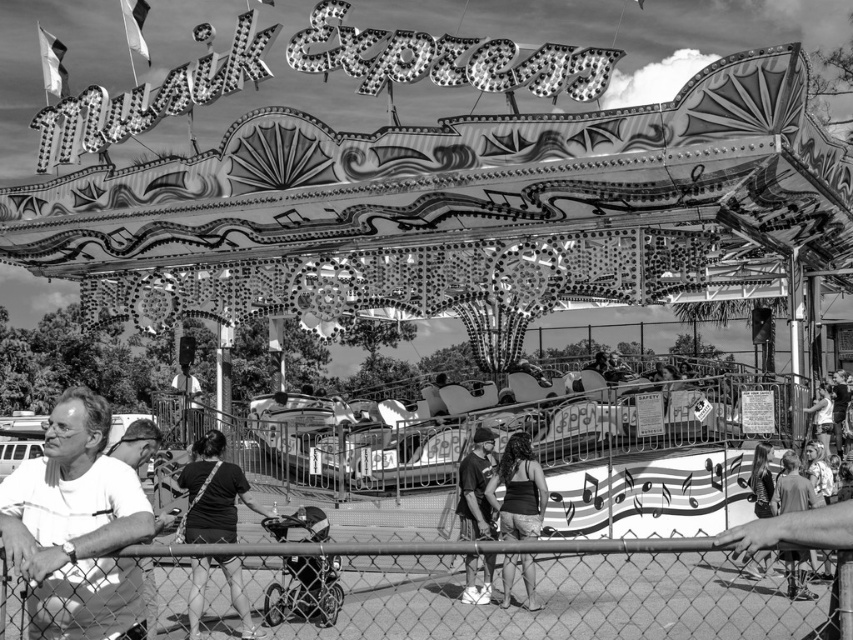
Is point (86, 509) behind point (212, 480)?

No.

Is white matte shirt at lower left smaller than dark gray fabric purse at lower center?

Indeed, white matte shirt at lower left has a smaller size compared to dark gray fabric purse at lower center.

Where is `white matte shirt at lower left`? This screenshot has width=853, height=640. white matte shirt at lower left is located at coordinates (76, 528).

Is dark gray fabric purse at lower center closer to camera compared to dark hair at center?

No, dark gray fabric purse at lower center is behind dark hair at center.

Does dark gray fabric purse at lower center appear on the left side of dark hair at center?

Correct, you'll find dark gray fabric purse at lower center to the left of dark hair at center.

Which is behind, point (213, 541) or point (531, 531)?

Positioned behind is point (531, 531).

At what (x,y) coordinates should I click in order to perform the action: click on dark gray fabric purse at lower center. Please return your answer as a coordinate pair (x, y). Looking at the image, I should click on (212, 493).

Between point (225, 602) and point (45, 564), which one is positioned in front?

Point (45, 564)

Is chain link fence at lower center below white matte shirt at lower left?

Indeed, chain link fence at lower center is positioned under white matte shirt at lower left.

Between point (606, 596) and point (22, 532), which one is positioned behind?

The point (606, 596) is behind.

This screenshot has height=640, width=853. I want to click on chain link fence at lower center, so click(x=424, y=593).